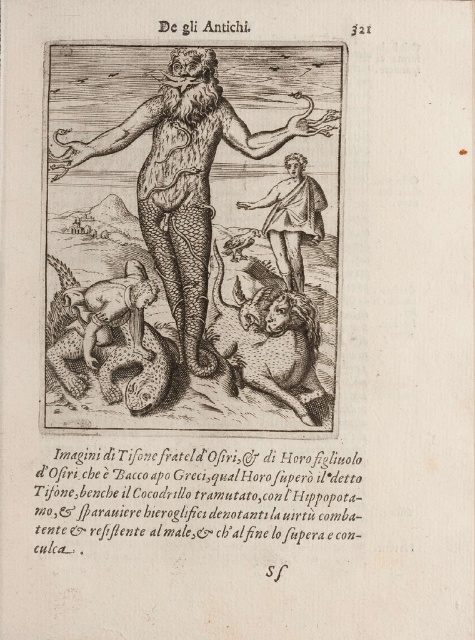
From the picture: Based on the scene described, which object is larger in size between the brown textured skin deity at center and the smooth white toga at center?

The brown textured skin deity at center is bigger than the smooth white toga at center.

Based on the illustration from the historical book, where is the brown textured skin deity at center located in terms of coordinates?

The brown textured skin deity at center is located at point [186,176].